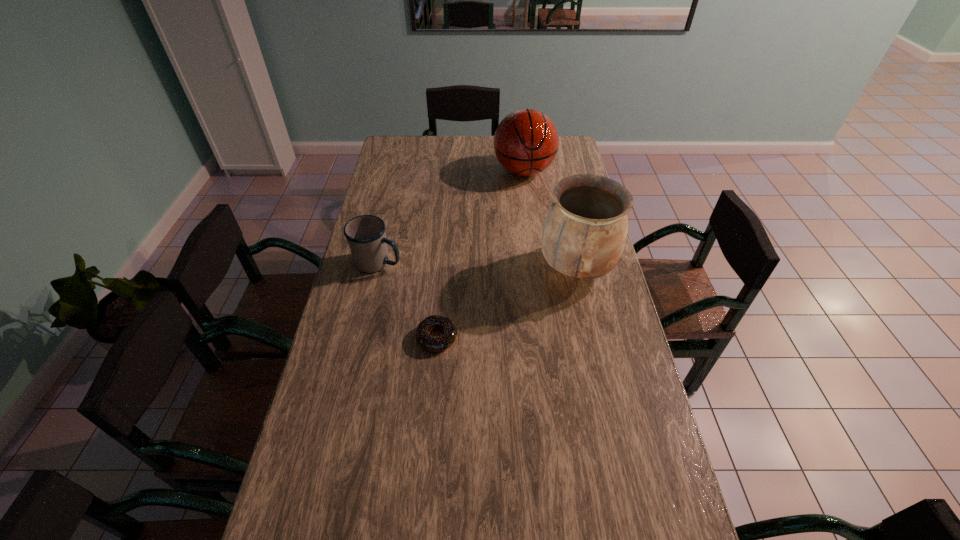
At what (x,y) coordinates should I click in order to perform the action: click on vacant space in between the farthest object and the third tallest object. Please return your answer as a coordinate pair (x, y). The height and width of the screenshot is (540, 960). Looking at the image, I should click on (451, 217).

The image size is (960, 540). In order to click on free space between the third object from right to left and the third tallest object in this screenshot , I will do click(x=408, y=300).

Where is `vacant space that is in between the urn and the second shortest object`? The height and width of the screenshot is (540, 960). vacant space that is in between the urn and the second shortest object is located at coordinates (477, 266).

The width and height of the screenshot is (960, 540). I want to click on vacant area that lies between the basketball and the shortest object, so click(x=480, y=254).

What are the coordinates of `free space that is in between the basketball and the shortest object` in the screenshot? It's located at (480, 254).

Locate which object ranks in proximity to the urn. Please provide its 2D coordinates. Your answer should be formatted as a tuple, i.e. [(x, y)], where the tuple contains the x and y coordinates of a point satisfying the conditions above.

[(435, 344)]

The height and width of the screenshot is (540, 960). In order to click on object that ranks as the closest to the leftmost object in this screenshot , I will do `click(435, 344)`.

Where is `vacant space that satisfies the following two spatial constraints: 1. on the back side of the urn; 2. on the left side of the second object from left to right`? vacant space that satisfies the following two spatial constraints: 1. on the back side of the urn; 2. on the left side of the second object from left to right is located at coordinates (443, 269).